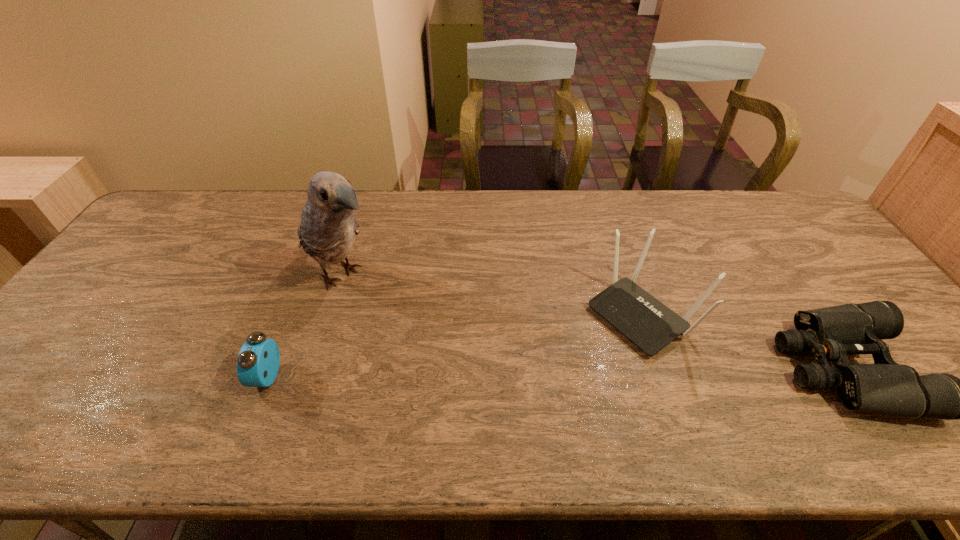
I want to click on free area in between the parrot and the second object from right to left, so click(x=492, y=295).

This screenshot has width=960, height=540. Find the location of `unoccupied position between the router and the second shortest object`. unoccupied position between the router and the second shortest object is located at coordinates (455, 345).

Find the location of a particular element. vacant area between the second object from right to left and the rightmost object is located at coordinates point(744,341).

At what (x,y) coordinates should I click in order to perform the action: click on free spot between the parrot and the router. Please return your answer as a coordinate pair (x, y). Looking at the image, I should click on (492, 295).

The height and width of the screenshot is (540, 960). What are the coordinates of `free point between the parrot and the shortest object` in the screenshot? It's located at (593, 321).

Where is `empty space that is in between the alarm clock and the second tallest object`? The image size is (960, 540). empty space that is in between the alarm clock and the second tallest object is located at coordinates (455, 345).

Locate an element on the screen. free space that is in between the second tallest object and the alarm clock is located at coordinates (455, 345).

Locate an element on the screen. This screenshot has height=540, width=960. the second closest object to the alarm clock is located at coordinates (649, 324).

At what (x,y) coordinates should I click in order to perform the action: click on the closest object to the router. Please return your answer as a coordinate pair (x, y). The width and height of the screenshot is (960, 540). Looking at the image, I should click on (832, 333).

Locate an element on the screen. This screenshot has width=960, height=540. blank area in the image that satisfies the following two spatial constraints: 1. on the front side of the tallest object; 2. through the eyepieces of the binoculars is located at coordinates coord(313,368).